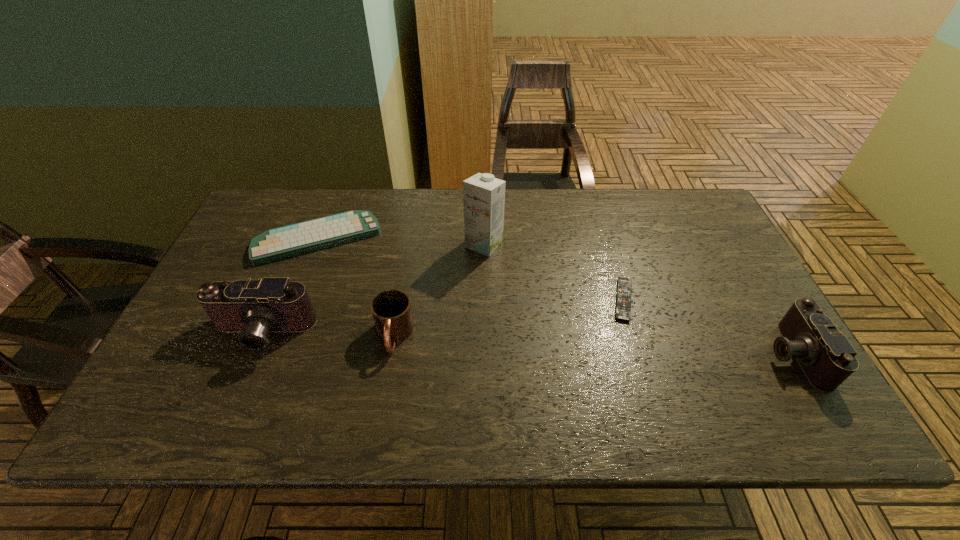
Image resolution: width=960 pixels, height=540 pixels. In order to click on the second tallest object in this screenshot , I will do `click(254, 308)`.

Find the location of a particular element. The width and height of the screenshot is (960, 540). the taller camera is located at coordinates (254, 308).

Locate an element on the screen. the shorter camera is located at coordinates (826, 356).

The image size is (960, 540). In order to click on the rightmost object in this screenshot , I will do `click(826, 356)`.

This screenshot has width=960, height=540. I want to click on the shortest object, so click(x=623, y=308).

The image size is (960, 540). In order to click on the second object from right to left in this screenshot , I will do `click(623, 308)`.

Where is `the tallest object`? The image size is (960, 540). the tallest object is located at coordinates (483, 195).

Locate an element on the screen. the fourth object from left to right is located at coordinates (483, 195).

The image size is (960, 540). In order to click on computer keyboard in this screenshot , I will do `click(287, 241)`.

I want to click on mug, so click(x=391, y=309).